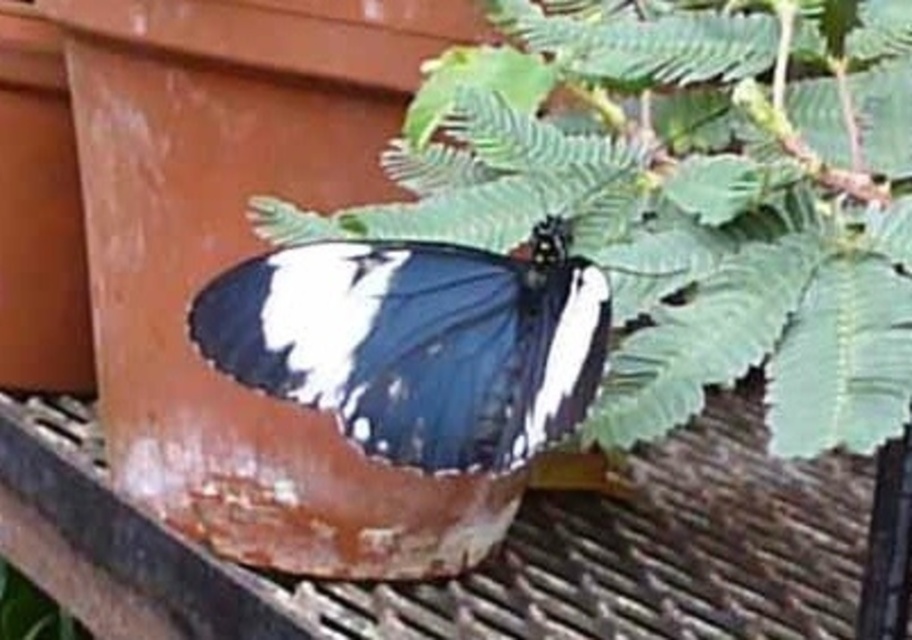
Who is more forward, (765, 17) or (215, 349)?

Point (215, 349)

Locate an element on the screen. The height and width of the screenshot is (640, 912). green leafy plant at upper center is located at coordinates (688, 198).